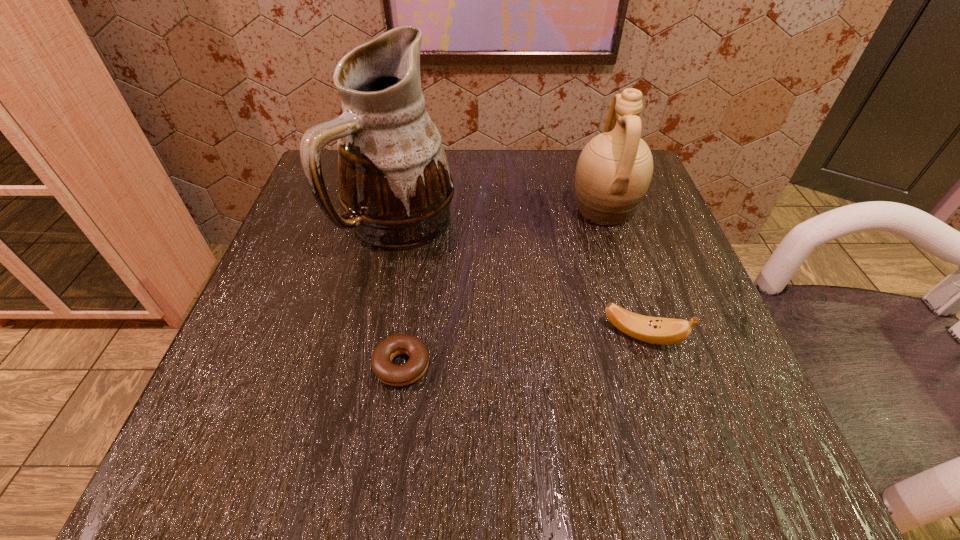
Locate an element on the screen. This screenshot has height=540, width=960. blank space at the near left corner is located at coordinates (243, 418).

What are the coordinates of `free space between the taller pitcher and the third shortest object` in the screenshot? It's located at (502, 217).

Find the location of a particular element. The height and width of the screenshot is (540, 960). empty location between the shortest object and the banana is located at coordinates [x=521, y=350].

Where is `free space between the shorter pitcher and the shortest object`? The height and width of the screenshot is (540, 960). free space between the shorter pitcher and the shortest object is located at coordinates (503, 288).

The width and height of the screenshot is (960, 540). What are the coordinates of `vacant space that is in between the second shortest object and the right pitcher` in the screenshot? It's located at (622, 273).

You are a GUI agent. You are given a task and a screenshot of the screen. Output one action in this format:
    pyautogui.click(x=<x>, y=<y>)
    Task: Click on the vacant point located between the banana and the shortest object
    The image size is (960, 540).
    Given the screenshot: What is the action you would take?
    pyautogui.click(x=521, y=350)

Where is `free area in between the third shortest object and the banana`? Image resolution: width=960 pixels, height=540 pixels. free area in between the third shortest object and the banana is located at coordinates (622, 273).

This screenshot has width=960, height=540. In order to click on free area in between the shortest object and the right pitcher in this screenshot , I will do `click(503, 288)`.

I want to click on free space between the second tallest object and the doughnut, so click(503, 288).

Find the location of a particular element. vacant area that lies between the left pitcher and the banana is located at coordinates (520, 280).